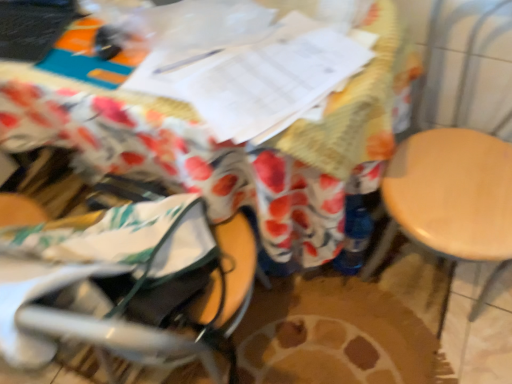
Question: Is gray fabric baby carriage at lower left inside or outside of light wood swivel chair at right?

Choices:
 (A) outside
 (B) inside

Answer: (A)

Question: From a real-world perspective, relative to light wood swivel chair at right, is gray fabric baby carriage at lower left vertically above or below?

Choices:
 (A) above
 (B) below

Answer: (A)

Question: Which of these objects is positioned farthest from the light wood swivel chair at right?

Choices:
 (A) gray fabric baby carriage at lower left
 (B) wooden table at center

Answer: (A)

Question: Estimate the real-world distances between objects in this image. Which object is farther from the wooden table at center?

Choices:
 (A) gray fabric baby carriage at lower left
 (B) light wood swivel chair at right

Answer: (B)